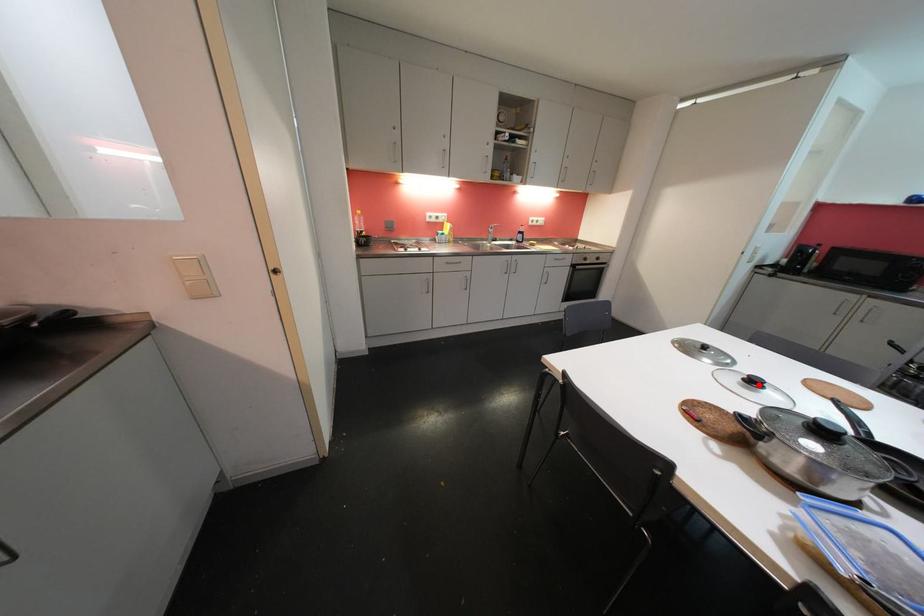
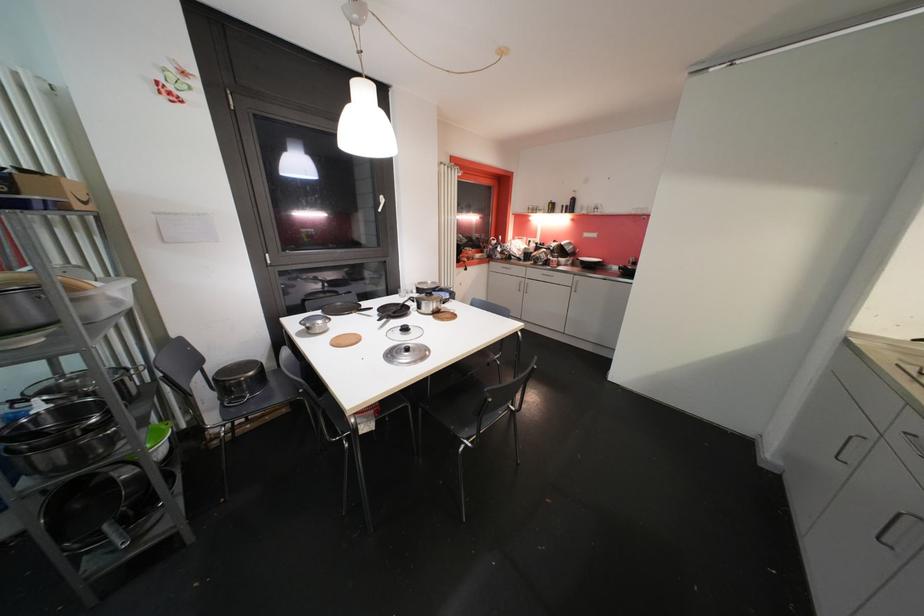
Locate, in the second image, the point that corresponds to the highlighted location in the first image.

(410, 331)